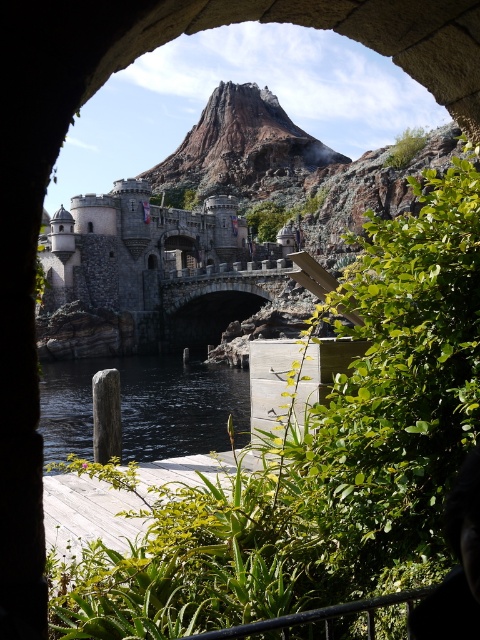
Does green leafy plant at center appear under stone bridge at center?

Yes, green leafy plant at center is below stone bridge at center.

Who is more forward, (415, 465) or (131, 310)?

Point (415, 465) is in front.

Where is `green leafy plant at center`? The width and height of the screenshot is (480, 640). green leafy plant at center is located at coordinates (319, 456).

Which is in front, point (199, 282) or point (230, 394)?

Point (230, 394) is more forward.

Between stone bridge at center and black smooth water at lower center, which one is positioned higher?

stone bridge at center is higher up.

Is point (84, 355) more distant than point (63, 381)?

That is True.

At what (x,y) coordinates should I click in order to perform the action: click on stone bridge at center. Please return your answer as a coordinate pair (x, y). The width and height of the screenshot is (480, 640). Looking at the image, I should click on (147, 273).

Between green leafy plant at center and black smooth water at lower center, which one has less height?

black smooth water at lower center is shorter.

Is green leafy plant at center wider than black smooth water at lower center?

Indeed, green leafy plant at center has a greater width compared to black smooth water at lower center.

Who is more distant from viewer, (146,620) or (44,432)?

The point (44,432) is more distant.

Image resolution: width=480 pixels, height=640 pixels. Find the location of `green leafy plant at center`. green leafy plant at center is located at coordinates (319, 456).